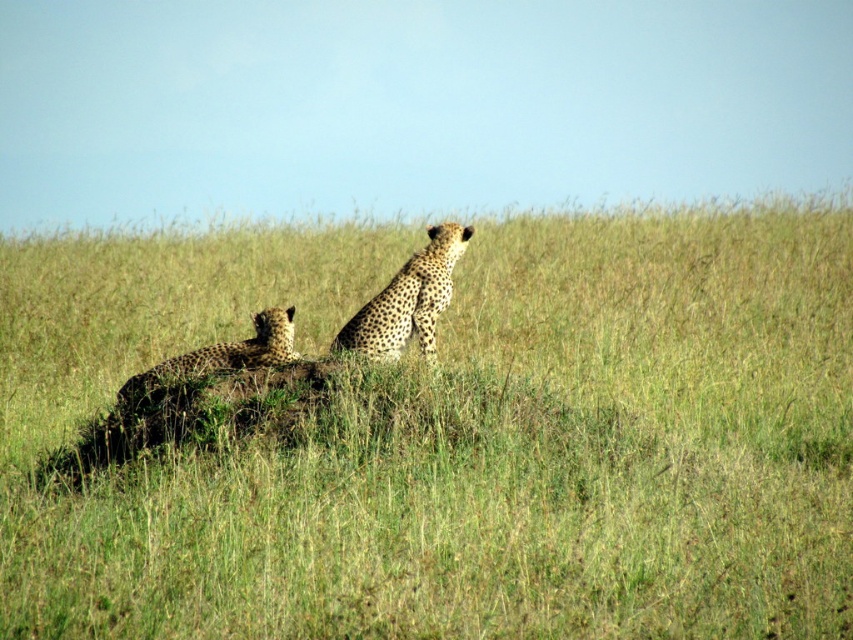
Question: Considering the relative positions of spotted fur cheetah at center and spotted fur cheetah at lower left in the image provided, where is spotted fur cheetah at center located with respect to spotted fur cheetah at lower left?

Choices:
 (A) above
 (B) below

Answer: (A)

Question: Among these points, which one is nearest to the camera?

Choices:
 (A) (415, 291)
 (B) (144, 372)
 (C) (229, 492)

Answer: (C)

Question: Can you confirm if green grass at center is thinner than spotted fur cheetah at lower left?

Choices:
 (A) yes
 (B) no

Answer: (B)

Question: Is spotted fur cheetah at center below spotted fur cheetah at lower left?

Choices:
 (A) no
 (B) yes

Answer: (A)

Question: Which of these objects is positioned closest to the spotted fur cheetah at lower left?

Choices:
 (A) spotted fur cheetah at center
 (B) green grass at center

Answer: (A)

Question: Which object appears closest to the camera in this image?

Choices:
 (A) spotted fur cheetah at lower left
 (B) spotted fur cheetah at center

Answer: (A)